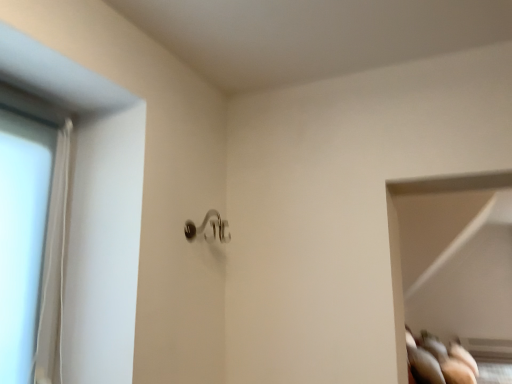
Question: Does satin nickel door handle at center have a smaller size compared to transparent glass door at left?

Choices:
 (A) yes
 (B) no

Answer: (A)

Question: Considering the relative sizes of satin nickel door handle at center and transparent glass door at left in the image provided, is satin nickel door handle at center thinner than transparent glass door at left?

Choices:
 (A) yes
 (B) no

Answer: (B)

Question: Would you say transparent glass door at left is part of satin nickel door handle at center's contents?

Choices:
 (A) yes
 (B) no

Answer: (B)

Question: Would you say satin nickel door handle at center is a long distance from transparent glass door at left?

Choices:
 (A) yes
 (B) no

Answer: (B)

Question: Could you tell me if satin nickel door handle at center is turned towards transparent glass door at left?

Choices:
 (A) yes
 (B) no

Answer: (B)

Question: Is satin nickel door handle at center at the right side of transparent glass door at left?

Choices:
 (A) yes
 (B) no

Answer: (A)

Question: Does transparent glass door at left have a greater height compared to satin nickel door handle at center?

Choices:
 (A) no
 (B) yes

Answer: (B)

Question: Is transparent glass door at left smaller than satin nickel door handle at center?

Choices:
 (A) no
 (B) yes

Answer: (A)

Question: Could you tell me if transparent glass door at left is turned towards satin nickel door handle at center?

Choices:
 (A) yes
 (B) no

Answer: (B)

Question: Is transparent glass door at left turned away from satin nickel door handle at center?

Choices:
 (A) yes
 (B) no

Answer: (B)

Question: Is transparent glass door at left far away from satin nickel door handle at center?

Choices:
 (A) no
 (B) yes

Answer: (A)

Question: From the image's perspective, is transparent glass door at left located above satin nickel door handle at center?

Choices:
 (A) no
 (B) yes

Answer: (A)

Question: Is transparent glass door at left taller or shorter than satin nickel door handle at center?

Choices:
 (A) short
 (B) tall

Answer: (B)